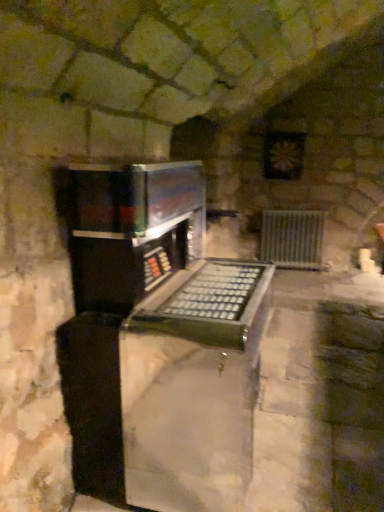
The image size is (384, 512). Identify the location of metallic silver radiator at center right. (292, 238).

What do you see at coordinates (292, 238) in the screenshot? The width and height of the screenshot is (384, 512). I see `metallic silver radiator at center right` at bounding box center [292, 238].

The height and width of the screenshot is (512, 384). Describe the element at coordinates (154, 336) in the screenshot. I see `metallic black keyboard at center` at that location.

Looking at this image, in order to face metallic black keyboard at center, should I rotate leftwards or rightwards?

It's best to rotate right around 0.531 degrees.

Where is `metallic black keyboard at center`? This screenshot has height=512, width=384. metallic black keyboard at center is located at coordinates (154, 336).

What is the approximate height of metallic black keyboard at center?

The height of metallic black keyboard at center is 1.37 meters.

Identify the location of metallic silver radiator at center right. (292, 238).

Does metallic silver radiator at center right appear on the right side of metallic black keyboard at center?

Indeed, metallic silver radiator at center right is positioned on the right side of metallic black keyboard at center.

Looking at this image, which object is closer to the camera taking this photo, metallic silver radiator at center right or metallic black keyboard at center?

metallic black keyboard at center.

Considering the points (275, 260) and (89, 221), which point is behind, point (275, 260) or point (89, 221)?

The point (275, 260) is farther.

From the image's perspective, is metallic silver radiator at center right located beneath metallic black keyboard at center?

Actually, metallic silver radiator at center right appears above metallic black keyboard at center in the image.

From a real-world perspective, which object rests below the other?

metallic silver radiator at center right.

Can you confirm if metallic silver radiator at center right is thinner than metallic black keyboard at center?

Indeed, metallic silver radiator at center right has a lesser width compared to metallic black keyboard at center.

Who is taller, metallic silver radiator at center right or metallic black keyboard at center?

With more height is metallic black keyboard at center.

In the scene shown: Does metallic silver radiator at center right have a larger size compared to metallic black keyboard at center?

No.

Is metallic silver radiator at center right completely or partially outside of metallic black keyboard at center?

Yes.

Would you say metallic silver radiator at center right is a long distance from metallic black keyboard at center?

Yes.

Is metallic silver radiator at center right facing towards metallic black keyboard at center?

Yes, metallic silver radiator at center right faces towards metallic black keyboard at center.

Consider the image. Can you tell me how much metallic silver radiator at center right and metallic black keyboard at center differ in facing direction?

The angular difference between metallic silver radiator at center right and metallic black keyboard at center is 86.5 degrees.

How much distance is there between metallic silver radiator at center right and metallic black keyboard at center?

metallic silver radiator at center right is 12.02 feet away from metallic black keyboard at center.

Where is `radiator above the metallic black keyboard at center (from the image's perspective)`? radiator above the metallic black keyboard at center (from the image's perspective) is located at coordinates (292, 238).

Considering the positions of objects metallic black keyboard at center and metallic silver radiator at center right in the image provided, who is more to the right, metallic black keyboard at center or metallic silver radiator at center right?

metallic silver radiator at center right is more to the right.

Who is more distant, metallic black keyboard at center or metallic silver radiator at center right?

metallic silver radiator at center right is more distant.

Is point (155, 358) in front of point (307, 228)?

That is True.

From the image's perspective, is metallic black keyboard at center over metallic silver radiator at center right?

No, from the image's perspective, metallic black keyboard at center is not on top of metallic silver radiator at center right.

From a real-world perspective, who is located lower, metallic black keyboard at center or metallic silver radiator at center right?

metallic silver radiator at center right.

Which object is wider, metallic black keyboard at center or metallic silver radiator at center right?

Wider between the two is metallic black keyboard at center.

Is metallic black keyboard at center taller than metallic silver radiator at center right?

Correct, metallic black keyboard at center is much taller as metallic silver radiator at center right.

Between metallic black keyboard at center and metallic silver radiator at center right, which one has smaller size?

Smaller between the two is metallic silver radiator at center right.

Does metallic black keyboard at center contain metallic silver radiator at center right?

That's incorrect, metallic silver radiator at center right is not inside metallic black keyboard at center.

Is metallic black keyboard at center placed right next to metallic silver radiator at center right?

metallic black keyboard at center and metallic silver radiator at center right are not in contact.

Is metallic black keyboard at center oriented towards metallic silver radiator at center right?

No, metallic black keyboard at center is not aimed at metallic silver radiator at center right.

In order to click on appliance that is below the metallic silver radiator at center right (from the image's perspective) in this screenshot , I will do `click(154, 336)`.

Where is `appliance in front of the metallic silver radiator at center right`? appliance in front of the metallic silver radiator at center right is located at coordinates (154, 336).

Where is `radiator below the metallic black keyboard at center (from a real-world perspective)`? radiator below the metallic black keyboard at center (from a real-world perspective) is located at coordinates (292, 238).